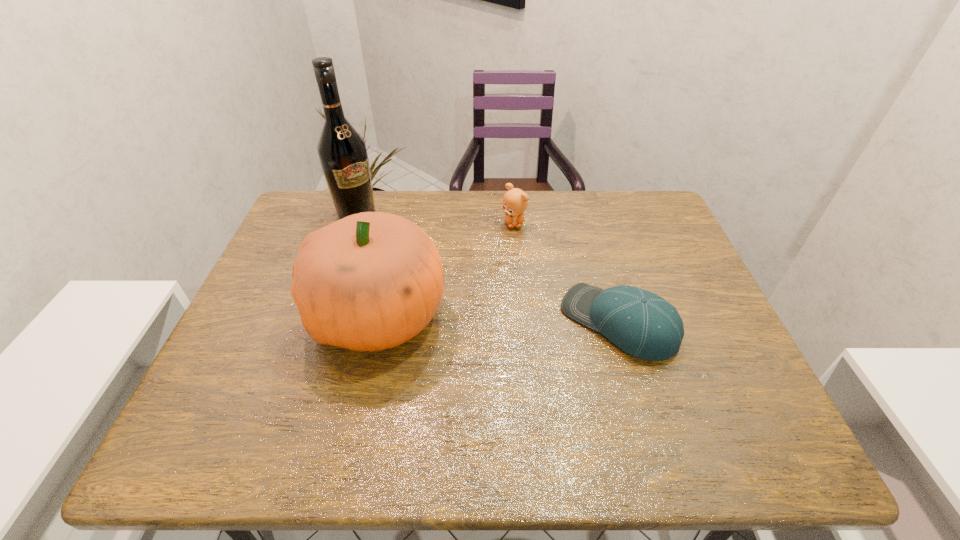
This screenshot has width=960, height=540. What are the coordinates of `the third shortest object` in the screenshot? It's located at (370, 281).

Where is `the shortest object`? This screenshot has height=540, width=960. the shortest object is located at coordinates (644, 325).

Identify the location of the rightmost object. (644, 325).

Where is `the tallest object`? the tallest object is located at coordinates [342, 151].

Find the location of a particular element. teddy bear is located at coordinates (515, 201).

This screenshot has width=960, height=540. I want to click on the third object from left to right, so click(515, 201).

At what (x,y) coordinates should I click in order to perform the action: click on free spot located on the face of the pumpkin. Please return your answer as a coordinate pair (x, y). This screenshot has width=960, height=540. Looking at the image, I should click on (259, 314).

The height and width of the screenshot is (540, 960). I want to click on free space located 0.150m on the face of the pumpkin, so click(252, 314).

In order to click on vacant space situated 0.380m on the back of the rightmost object in this screenshot , I will do pos(583,202).

The image size is (960, 540). In order to click on vacant space situated on the label of the wine bottle in this screenshot , I will do `click(441, 292)`.